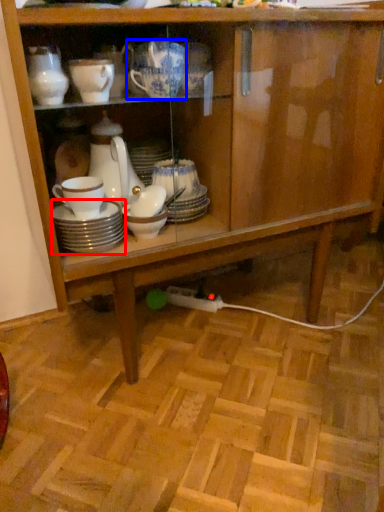
Question: Which of the following is the farthest to the observer, tableware (highlighted by a red box) or tableware (highlighted by a blue box)?

Choices:
 (A) tableware
 (B) tableware

Answer: (A)